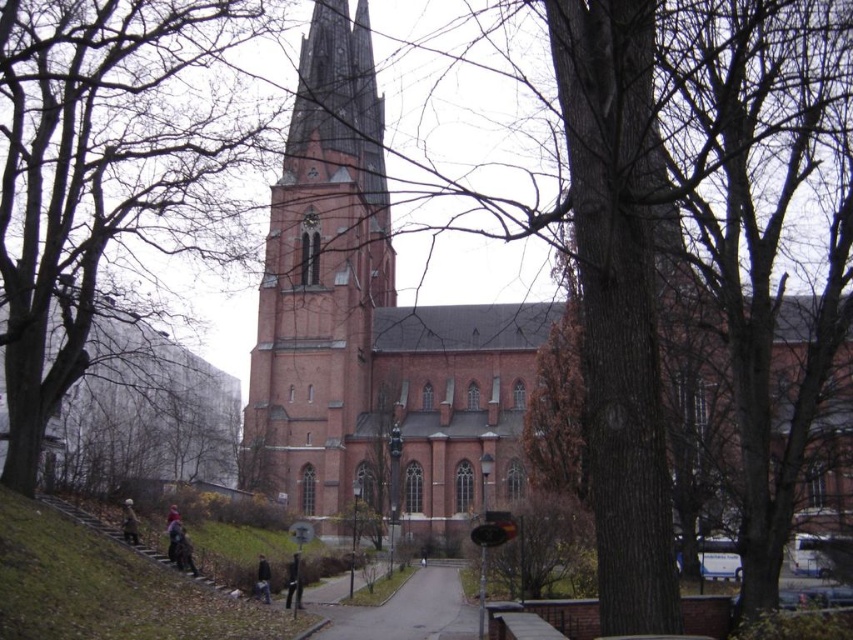
Question: Estimate the real-world distances between objects in this image. Which object is farther from the dark brown leather jacket at lower center?

Choices:
 (A) brown textured tree at center
 (B) gray asphalt path at center

Answer: (A)

Question: Can you confirm if black leather jacket at lower center is positioned below dark brown leather jacket at lower center?

Choices:
 (A) yes
 (B) no

Answer: (A)

Question: Is black leather jacket at lower center further to the viewer compared to dark gray jacket at lower left?

Choices:
 (A) no
 (B) yes

Answer: (A)

Question: Based on their relative distances, which object is farther from the black leather jacket at lower center?

Choices:
 (A) gray asphalt path at center
 (B) brown textured tree at center
 (C) smooth brown tree trunk at center

Answer: (C)

Question: Among these objects, which one is nearest to the camera?

Choices:
 (A) gray asphalt path at center
 (B) brown textured tree at center
 (C) dark blue jacket at lower center
 (D) smooth brown tree trunk at center

Answer: (A)

Question: Can you confirm if red brick church at center is positioned to the right of dark gray jacket at lower left?

Choices:
 (A) no
 (B) yes

Answer: (B)